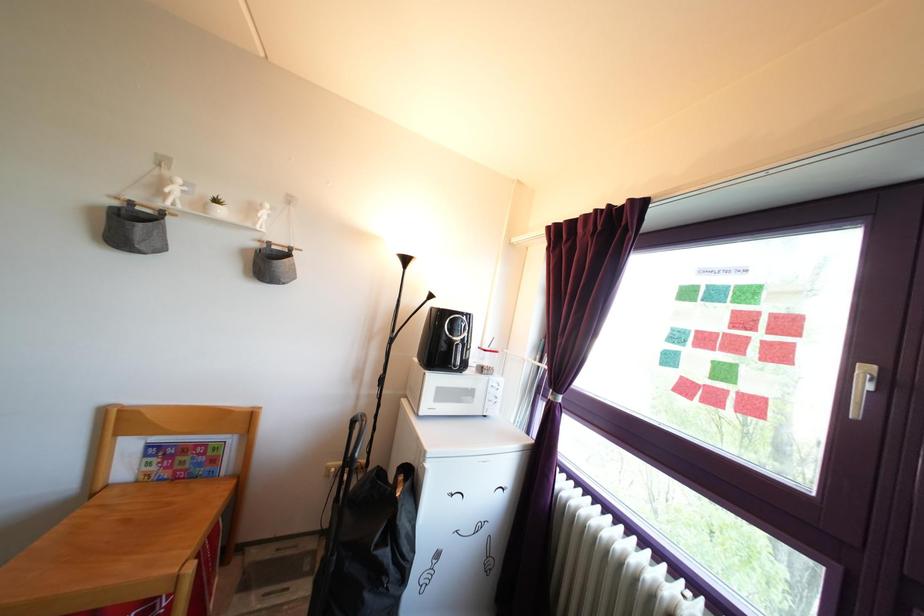
Image resolution: width=924 pixels, height=616 pixels. I want to click on trolley handle, so click(x=345, y=461).